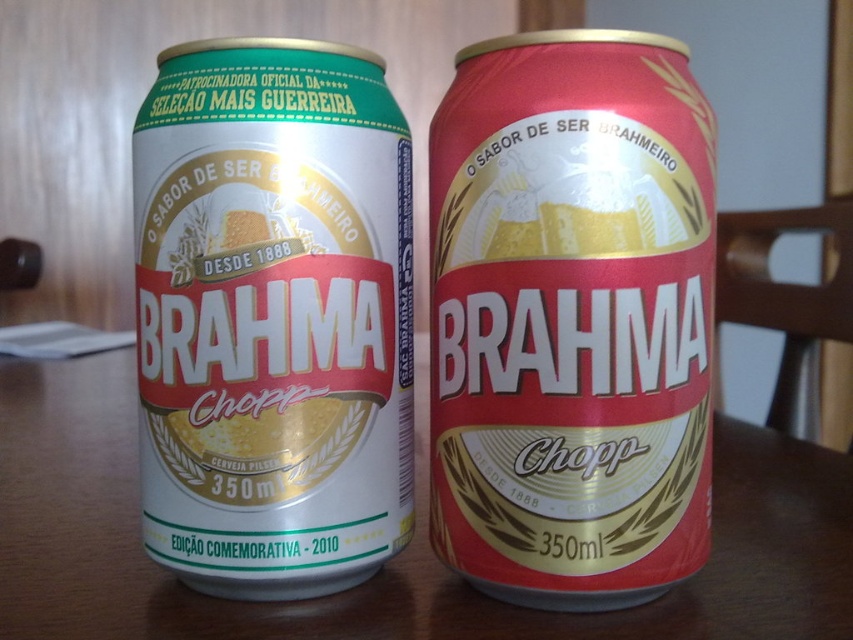
Consider the image. You are a customer at a bar and see two Brahma Chopp cans on a wooden table. The can on the left is white with green accents, and there is a point marked at coordinates (572, 317). Which can is located at that point?

The point at coordinates (572, 317) is occupied by the matte red can at center.

You are at a party and want to grab a Brahma Chopp can from the table. There are two cans here. One is a matte red can at center and the other is a white matte can at center. Which one is located on the right side?

The matte red can at center is located to the right of the white matte can at center.